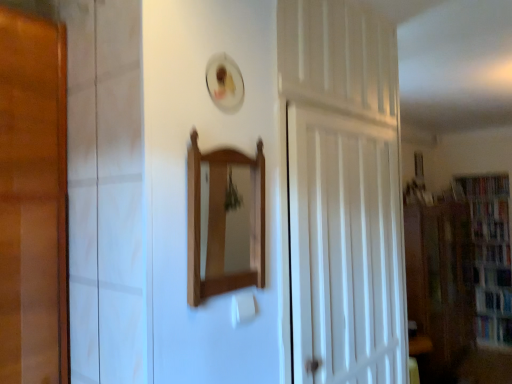
Question: Considering the positions of hardcover book at right, which is counted as the third book, starting from the bottom, and hardcover book at right, acting as the second book starting from the bottom, in the image, is hardcover book at right, which is counted as the third book, starting from the bottom, wider or thinner than hardcover book at right, acting as the second book starting from the bottom,?

Choices:
 (A) thin
 (B) wide

Answer: (A)

Question: Would you say hardcover book at right, marked as the second book in a top-to-bottom arrangement, is inside or outside hardcover book at right, acting as the second book starting from the bottom?

Choices:
 (A) outside
 (B) inside

Answer: (A)

Question: Which is nearer to the hardcover book at right, which is counted as the third book, starting from the bottom?

Choices:
 (A) light brown wood mirror at center
 (B) wooden bookcase at right
 (C) hardcover book at right, the 4th book ordered from the bottom
 (D) hardcover book at right, arranged as the 1th book when ordered from the bottom
 (E) hardcover book at right, acting as the second book starting from the bottom

Answer: (B)

Question: Which object is positioned closest to the light brown wood mirror at center?

Choices:
 (A) white wooden door at center
 (B) hardcover book at right, which is counted as the third book, starting from the bottom
 (C) transparent glass cabinet at right
 (D) hardcover book at right, arranged as the 1th book when ordered from the bottom
 (E) hardcover book at right, the 4th book ordered from the bottom

Answer: (A)